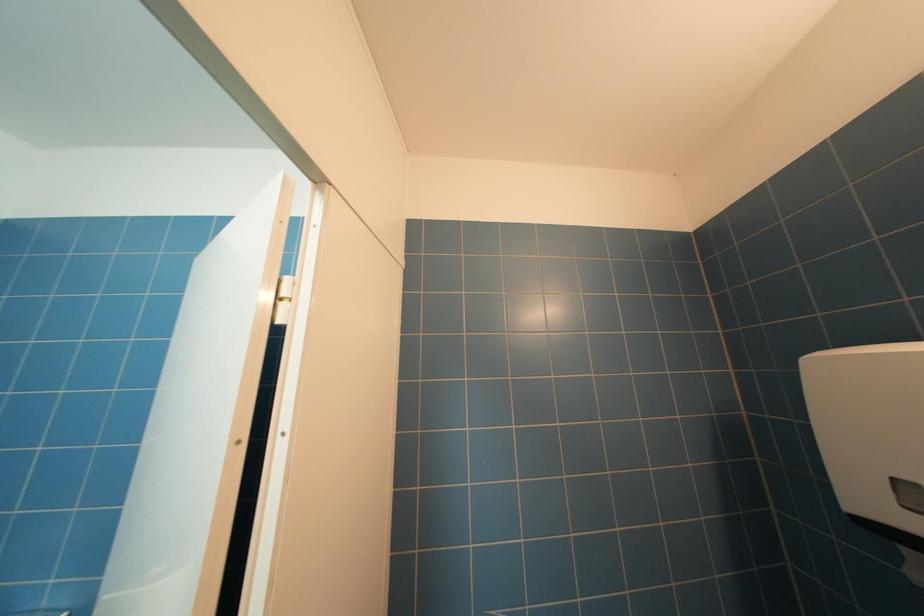
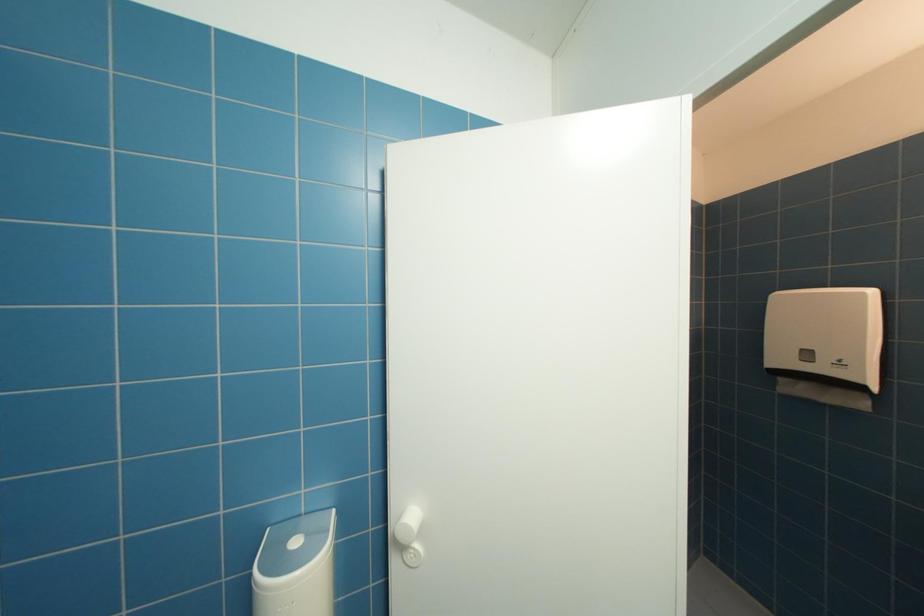
Question: The camera is either moving clockwise (left) or counter-clockwise (right) around the object. The first image is from the beginning of the video and the second image is from the end. Is the camera moving left or right when shooting the video?

Choices:
 (A) Left
 (B) Right

Answer: (A)